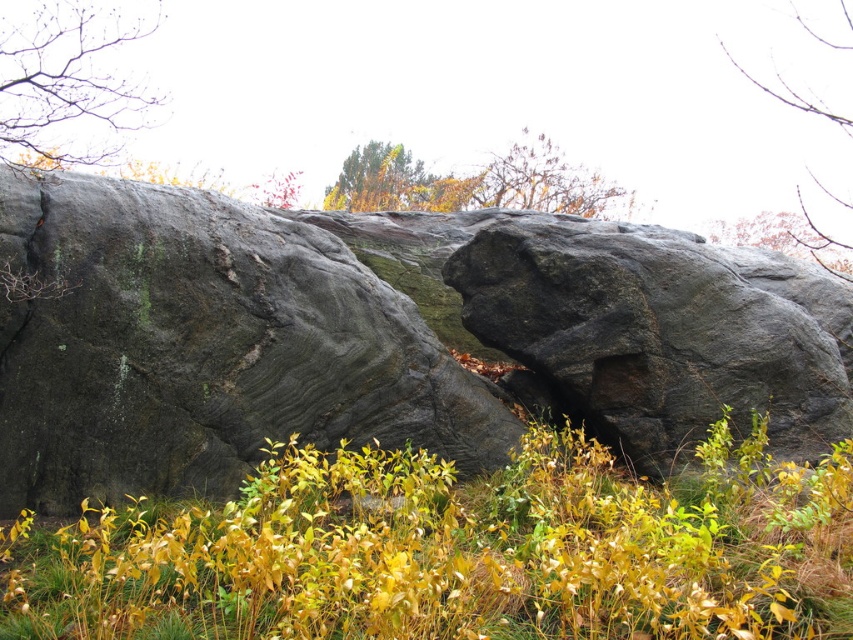
Does dark gray stone boulder at center have a lesser width compared to brown wood tree at upper right?

No.

Which of these two, dark gray stone boulder at center or brown wood tree at upper right, stands taller?

dark gray stone boulder at center is taller.

Which is behind, point (642, 365) or point (804, 22)?

Point (804, 22)

Where is `dark gray stone boulder at center`? Image resolution: width=853 pixels, height=640 pixels. dark gray stone boulder at center is located at coordinates (662, 332).

Can you confirm if yellow-green grass at center is bigger than brown textured tree at upper center?

Yes.

Which is in front, point (554, 477) or point (520, 132)?

Point (554, 477) is in front.

Describe the element at coordinates (456, 550) in the screenshot. I see `yellow-green grass at center` at that location.

You are a GUI agent. You are given a task and a screenshot of the screen. Output one action in this format:
    pyautogui.click(x=<x>, y=<y>)
    Task: Click on the yellow-green grass at center
    Image resolution: width=853 pixels, height=640 pixels.
    Given the screenshot: What is the action you would take?
    pyautogui.click(x=456, y=550)

Is point (566, 211) positioned after point (780, 96)?

No, (566, 211) is closer to viewer.

What are the coordinates of `brown textured tree at upper center` in the screenshot? It's located at (538, 180).

Is point (524, 132) less distant than point (848, 252)?

No.

This screenshot has width=853, height=640. I want to click on brown textured tree at upper center, so [538, 180].